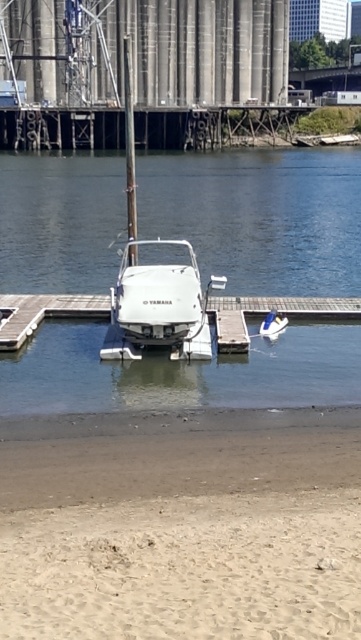
Is white glossy boat at center positioned before white plastic dock at center?

Yes, it is in front of white plastic dock at center.

What do you see at coordinates (261, 216) in the screenshot? The width and height of the screenshot is (361, 640). I see `white glossy boat at center` at bounding box center [261, 216].

At what (x,y) coordinates should I click in order to perform the action: click on white glossy boat at center. Please return your answer as a coordinate pair (x, y). Looking at the image, I should click on (261, 216).

Which of these two, white glossy boat at center or white matte boat at center, stands taller?

white glossy boat at center is taller.

Does point (32, 252) come farther from viewer compared to point (158, 241)?

No, (32, 252) is in front of (158, 241).

At what (x,y) coordinates should I click in order to perform the action: click on white glossy boat at center. Please return your answer as a coordinate pair (x, y). This screenshot has height=640, width=361. Looking at the image, I should click on (261, 216).

Between sandy beach at lower center and white plastic dock at center, which one has less height?

sandy beach at lower center is shorter.

Does sandy beach at lower center have a greater height compared to white plastic dock at center?

Incorrect, sandy beach at lower center's height is not larger of white plastic dock at center's.

Which is in front, point (128, 547) or point (15, 305)?

Point (128, 547) is in front.

At what (x,y) coordinates should I click in order to perform the action: click on sandy beach at lower center. Please return your answer as a coordinate pair (x, y). This screenshot has width=361, height=640. Looking at the image, I should click on (181, 525).